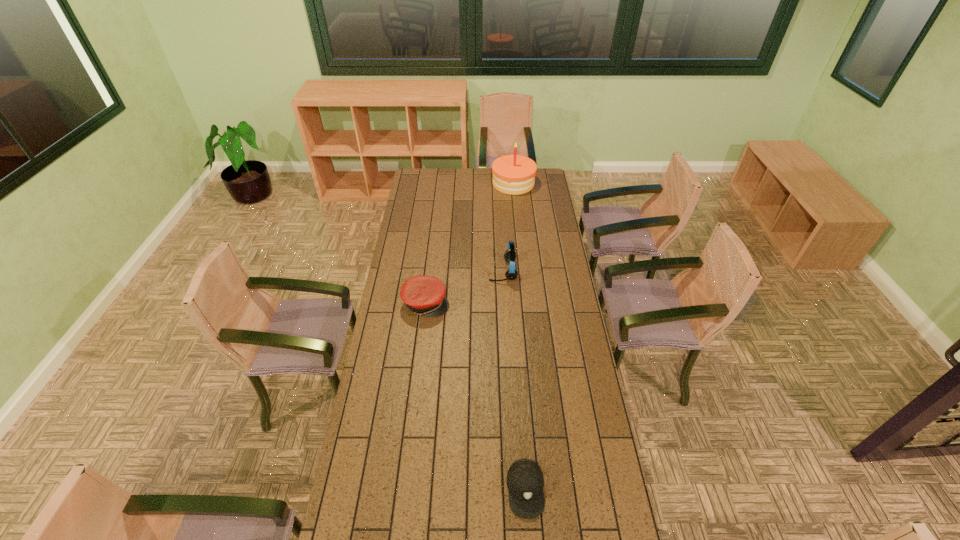
At what (x,y) coordinates should I click in order to perform the action: click on the tallest object. Please return your answer as a coordinate pair (x, y). This screenshot has height=540, width=960. Looking at the image, I should click on (514, 174).

This screenshot has height=540, width=960. In order to click on birthday cake in this screenshot , I will do `click(514, 174)`.

You are a GUI agent. You are given a task and a screenshot of the screen. Output one action in this format:
    pyautogui.click(x=<x>, y=<y>)
    Task: Click on the third nearest object
    
    Given the screenshot: What is the action you would take?
    pyautogui.click(x=510, y=255)

The height and width of the screenshot is (540, 960). I want to click on the second tallest object, so click(510, 255).

Locate an element on the screen. the farther cap is located at coordinates (425, 295).

Where is `the leftmost object`? the leftmost object is located at coordinates (425, 295).

This screenshot has height=540, width=960. What are the coordinates of `the nearest object` in the screenshot? It's located at (525, 481).

Image resolution: width=960 pixels, height=540 pixels. I want to click on the shortest object, so click(x=525, y=481).

At what (x,y) coordinates should I click in order to perform the action: click on free location located on the front of the farthest object. Please return your answer as a coordinate pair (x, y). The image size is (960, 540). Looking at the image, I should click on (516, 215).

At what (x,y) coordinates should I click in order to perform the action: click on vacant region located with the microphone attached to the side of the third shortest object. Please return your answer as a coordinate pair (x, y). The image size is (960, 540). Looking at the image, I should click on (420, 271).